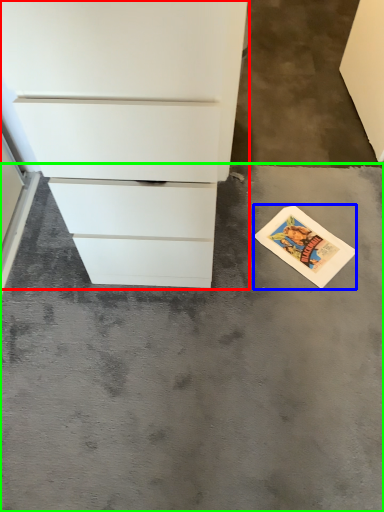
Question: Estimate the real-world distances between objects in this image. Which object is farther from chest of drawers (highlighted by a red box), postcard (highlighted by a blue box) or concrete (highlighted by a green box)?

Choices:
 (A) postcard
 (B) concrete

Answer: (A)